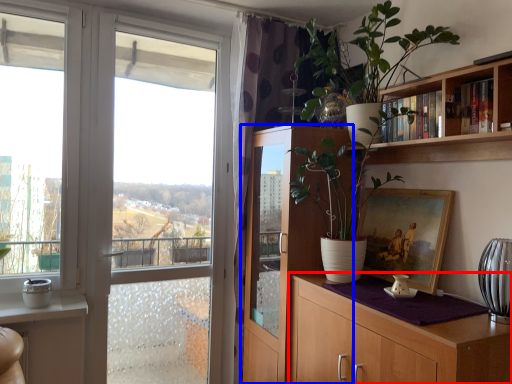
Question: Among these objects, which one is nearest to the camera, cabinetry (highlighted by a red box) or cabinetry (highlighted by a blue box)?

Choices:
 (A) cabinetry
 (B) cabinetry

Answer: (A)